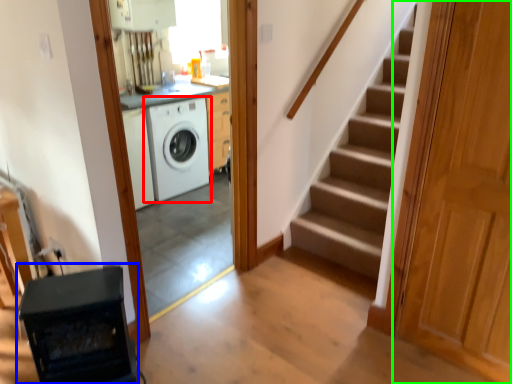
Question: Which object is the farthest from washing machine (highlighted by a red box)? Choose among these: appliance (highlighted by a blue box) or door (highlighted by a green box).

Choices:
 (A) appliance
 (B) door

Answer: (B)